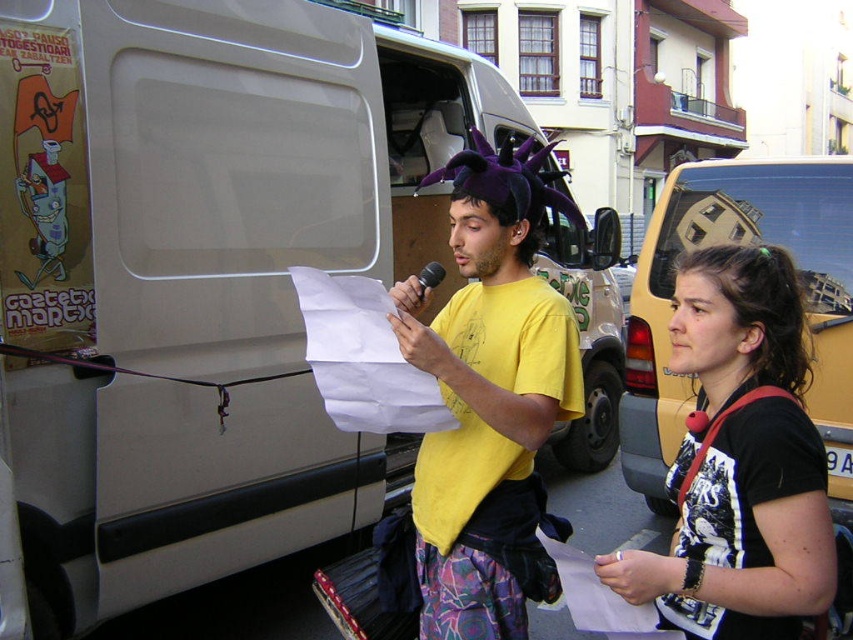
Question: Can you confirm if white paper at lower center is thinner than black plastic microphone at center?

Choices:
 (A) no
 (B) yes

Answer: (A)

Question: Among these objects, which one is nearest to the camera?

Choices:
 (A) white paper at center
 (B) white paper at lower center
 (C) matte white van at center

Answer: (B)

Question: Based on their relative distances, which object is farther from the white paper at lower center?

Choices:
 (A) white paper at center
 (B) yellow t-shirt at center

Answer: (A)

Question: Can you confirm if matte white van at center is bigger than white paper at center?

Choices:
 (A) no
 (B) yes

Answer: (B)

Question: Does matte white van at center appear over yellow t-shirt at center?

Choices:
 (A) no
 (B) yes

Answer: (B)

Question: Which point appears farthest from the camera in this image?

Choices:
 (A) (442, 272)
 (B) (476, 301)

Answer: (A)